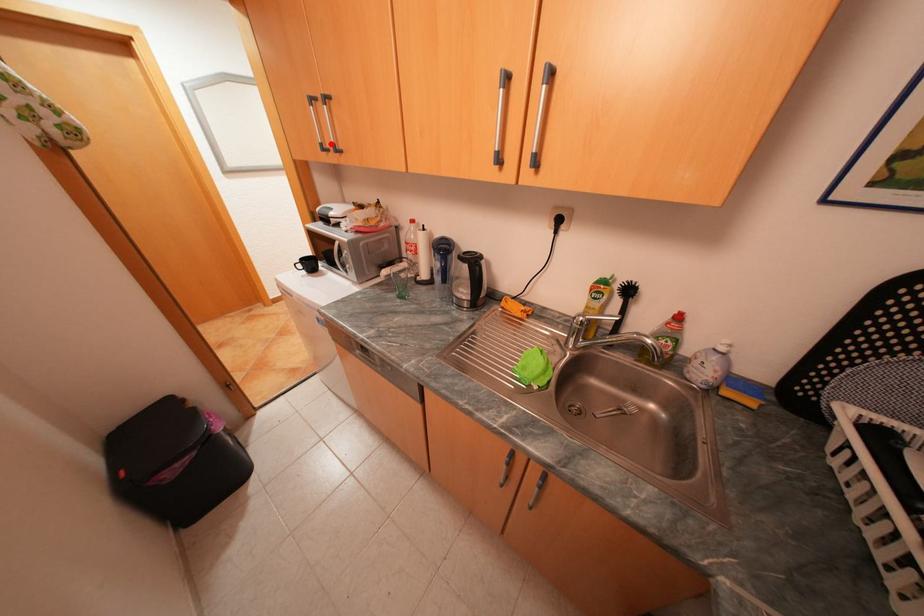
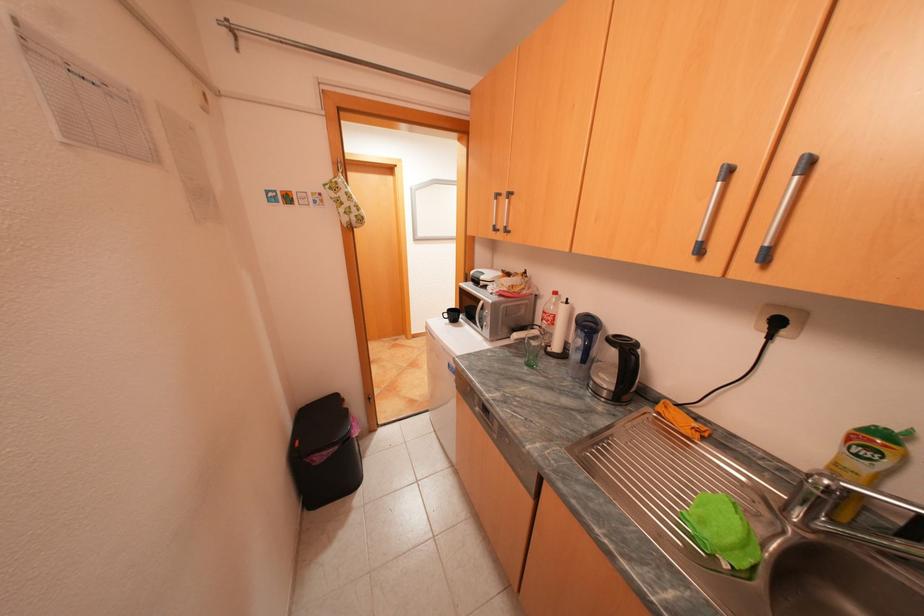
Where in the second image is the point corresponding to the highlighted location from the first image?

(504, 225)